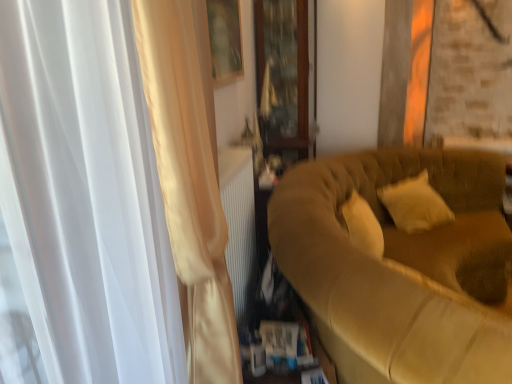
Question: From a real-world perspective, is suede-like beige couch at right over transparent wooden cabinet at center?

Choices:
 (A) no
 (B) yes

Answer: (A)

Question: Considering the relative sizes of suede-like beige couch at right and transparent wooden cabinet at center in the image provided, is suede-like beige couch at right taller than transparent wooden cabinet at center?

Choices:
 (A) yes
 (B) no

Answer: (B)

Question: Does suede-like beige couch at right have a larger size compared to transparent wooden cabinet at center?

Choices:
 (A) yes
 (B) no

Answer: (A)

Question: Considering the relative positions of suede-like beige couch at right and transparent wooden cabinet at center in the image provided, is suede-like beige couch at right to the left of transparent wooden cabinet at center from the viewer's perspective?

Choices:
 (A) yes
 (B) no

Answer: (B)

Question: Would you consider suede-like beige couch at right to be distant from transparent wooden cabinet at center?

Choices:
 (A) no
 (B) yes

Answer: (A)

Question: Relative to soft white pillow at right, is satin white curtain at left in front or behind?

Choices:
 (A) behind
 (B) front

Answer: (B)

Question: From the image's perspective, relative to soft white pillow at right, is satin white curtain at left above or below?

Choices:
 (A) below
 (B) above

Answer: (A)

Question: From a real-world perspective, is satin white curtain at left above or below soft white pillow at right?

Choices:
 (A) above
 (B) below

Answer: (A)

Question: Looking at their shapes, would you say satin white curtain at left is wider or thinner than soft white pillow at right?

Choices:
 (A) wide
 (B) thin

Answer: (B)

Question: From the image's perspective, is satin white curtain at left positioned above or below suede-like beige couch at right?

Choices:
 (A) below
 (B) above

Answer: (B)

Question: Is point (173, 236) positioned closer to the camera than point (357, 342)?

Choices:
 (A) farther
 (B) closer

Answer: (B)

Question: Is satin white curtain at left bigger or smaller than suede-like beige couch at right?

Choices:
 (A) small
 (B) big

Answer: (A)

Question: In terms of width, does satin white curtain at left look wider or thinner when compared to suede-like beige couch at right?

Choices:
 (A) wide
 (B) thin

Answer: (B)

Question: Would you say transparent wooden cabinet at center is inside or outside soft white pillow at right?

Choices:
 (A) outside
 (B) inside

Answer: (A)

Question: In the image, is transparent wooden cabinet at center on the left side or the right side of soft white pillow at right?

Choices:
 (A) left
 (B) right

Answer: (A)